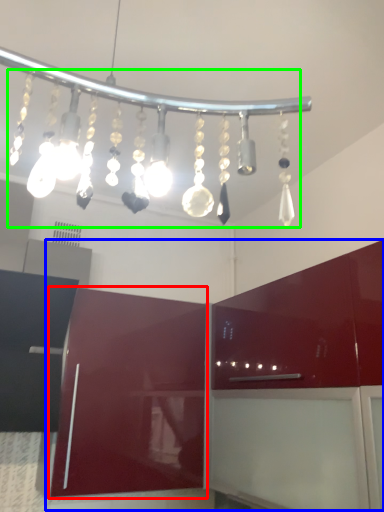
Question: Which is nearer to the cabinetry (highlighted by a red box)? cabinetry (highlighted by a blue box) or chandelier (highlighted by a green box).

Choices:
 (A) cabinetry
 (B) chandelier

Answer: (A)